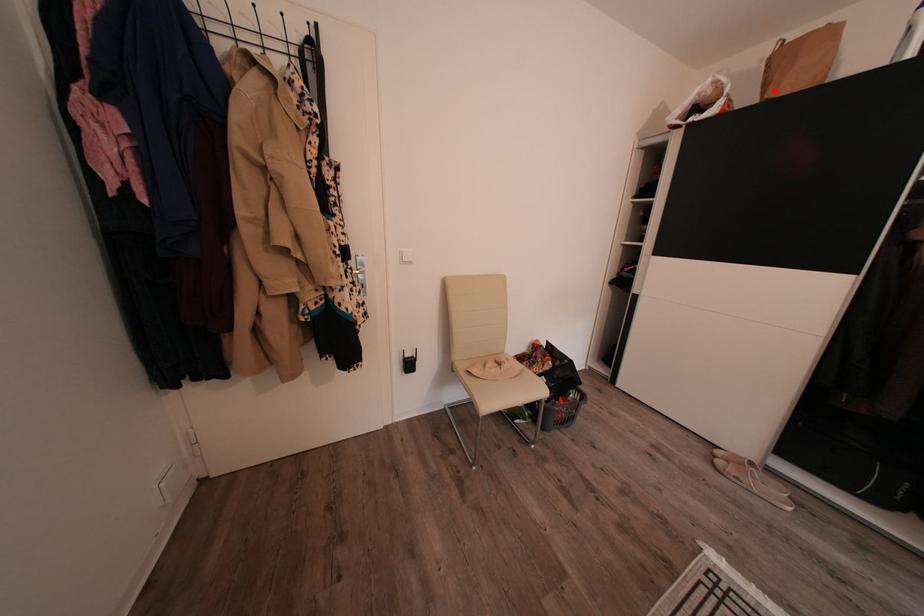
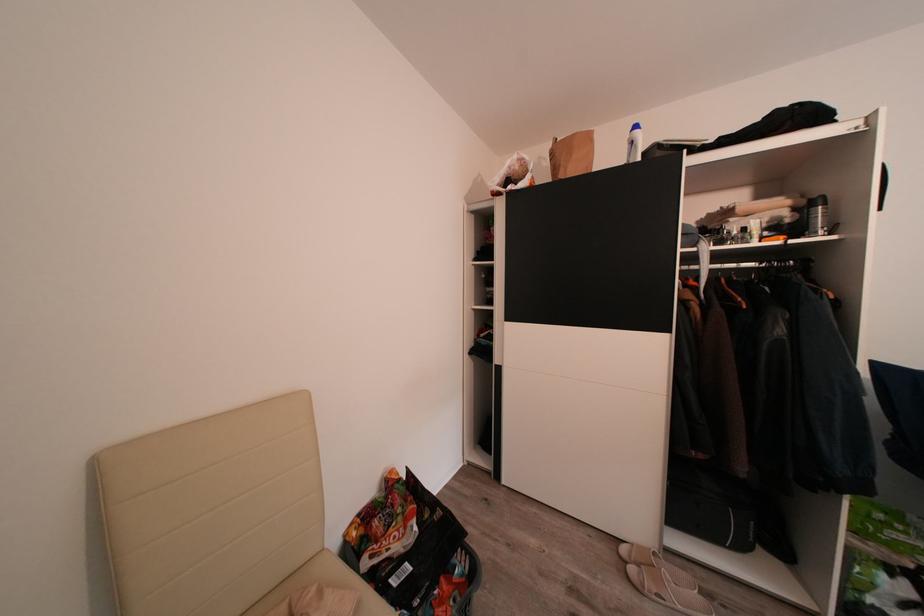
Question: I am providing you with two images of the same scene from different viewpoints. A red point is shown in image1. For the corresponding object point in image2, is it positioned nearer or farther from the camera?

Choices:
 (A) Nearer
 (B) Farther

Answer: (A)